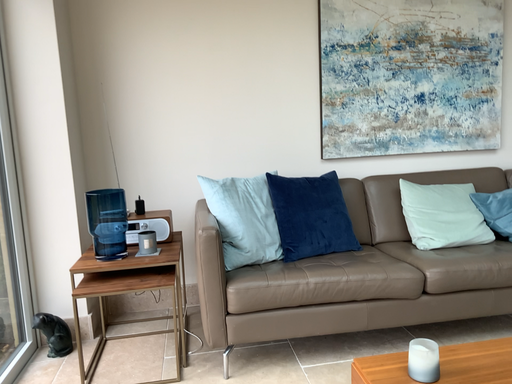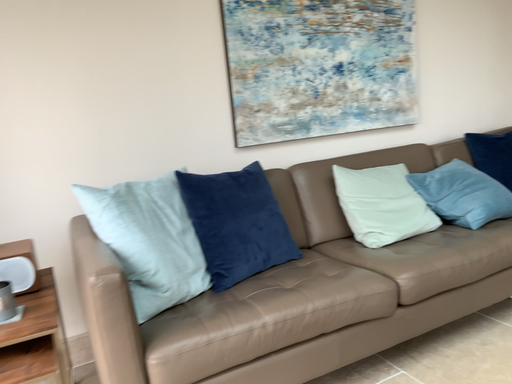
Question: Which way did the camera rotate in the video?

Choices:
 (A) rotated left
 (B) rotated right

Answer: (B)